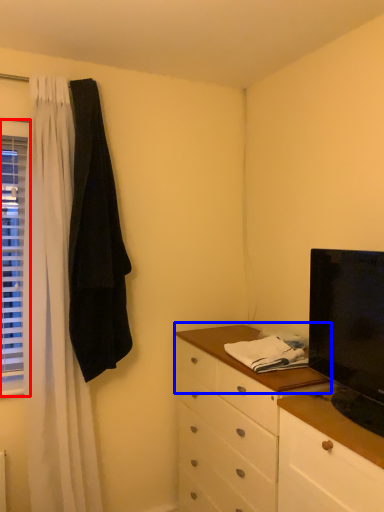
Question: Which point is further to the camera, window (highlighted by a red box) or counter top (highlighted by a blue box)?

Choices:
 (A) window
 (B) counter top

Answer: (A)